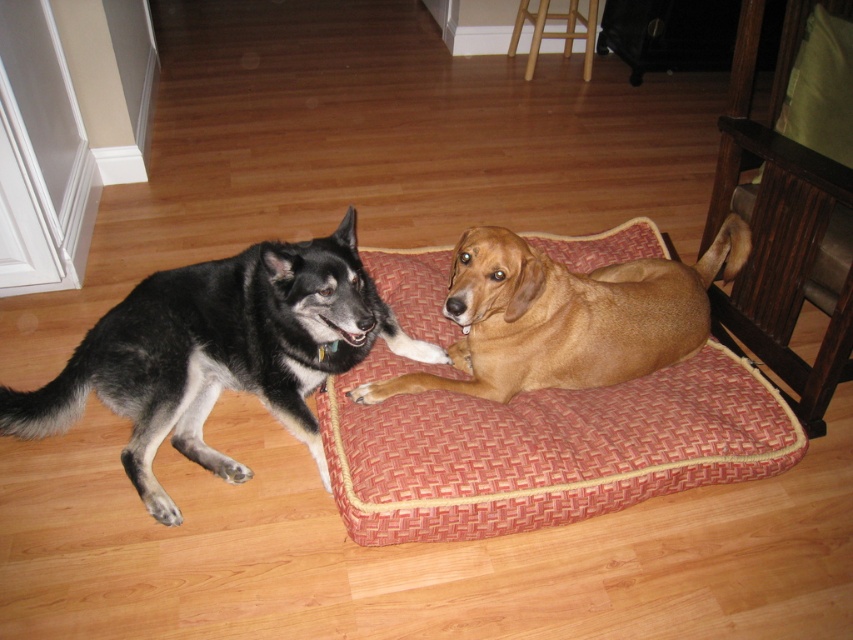
Is red woven fabric dog bed at center smaller than brown furry dog at center?

Incorrect, red woven fabric dog bed at center is not smaller in size than brown furry dog at center.

Who is more distant from viewer, (x=720, y=424) or (x=479, y=304)?

Positioned behind is point (x=720, y=424).

You are a GUI agent. You are given a task and a screenshot of the screen. Output one action in this format:
    pyautogui.click(x=<x>, y=<y>)
    Task: Click on the red woven fabric dog bed at center
    
    Given the screenshot: What is the action you would take?
    pyautogui.click(x=543, y=448)

Find the location of a particular element. red woven fabric dog bed at center is located at coordinates point(543,448).

Between black fur dog at left and brown furry dog at center, which one appears on the right side from the viewer's perspective?

Positioned to the right is brown furry dog at center.

Who is more forward, (x=439, y=362) or (x=606, y=374)?

Positioned in front is point (x=606, y=374).

Who is more forward, (97, 349) or (561, 337)?

Point (561, 337) is more forward.

Find the location of a particular element. black fur dog at left is located at coordinates (219, 353).

Is the position of red woven fabric dog bed at center less distant than that of black fur dog at left?

No, red woven fabric dog bed at center is further to the viewer.

The height and width of the screenshot is (640, 853). What do you see at coordinates (543, 448) in the screenshot?
I see `red woven fabric dog bed at center` at bounding box center [543, 448].

Where is `red woven fabric dog bed at center`? red woven fabric dog bed at center is located at coordinates (543, 448).